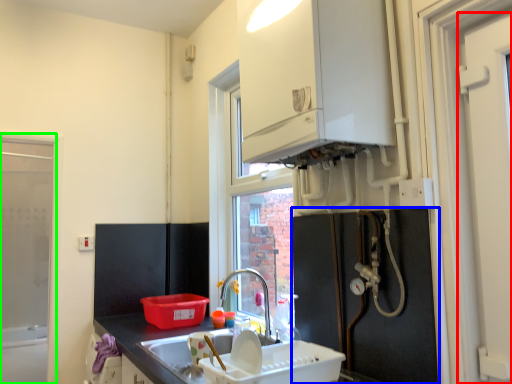
Question: Which is farther away from door (highlighted by a red box)? appliance (highlighted by a blue box) or window frame (highlighted by a green box)?

Choices:
 (A) appliance
 (B) window frame

Answer: (B)